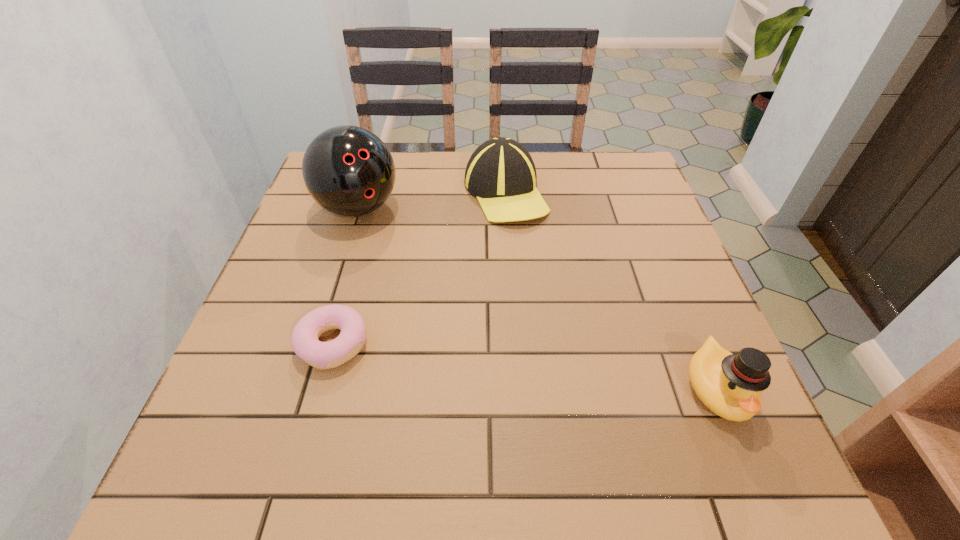
Image resolution: width=960 pixels, height=540 pixels. I want to click on free space between the second object from right to left and the tallest object, so click(432, 201).

Image resolution: width=960 pixels, height=540 pixels. I want to click on blank region between the baseball cap and the duck, so tap(612, 291).

In order to click on free area in between the baseball cap and the bowling ball in this screenshot , I will do `click(432, 201)`.

Identify the location of object that ranks as the closest to the second object from right to left. The image size is (960, 540). (349, 171).

The image size is (960, 540). I want to click on the third closest object to the second object from right to left, so click(x=730, y=385).

Where is `blank space that satisfies the following two spatial constraints: 1. on the back side of the doughnut; 2. on the right side of the third object from left to right`? The width and height of the screenshot is (960, 540). blank space that satisfies the following two spatial constraints: 1. on the back side of the doughnut; 2. on the right side of the third object from left to right is located at coordinates (375, 193).

The height and width of the screenshot is (540, 960). Identify the location of vacant region that satisfies the following two spatial constraints: 1. on the back side of the baseball cap; 2. on the left side of the shortest object. tap(375, 193).